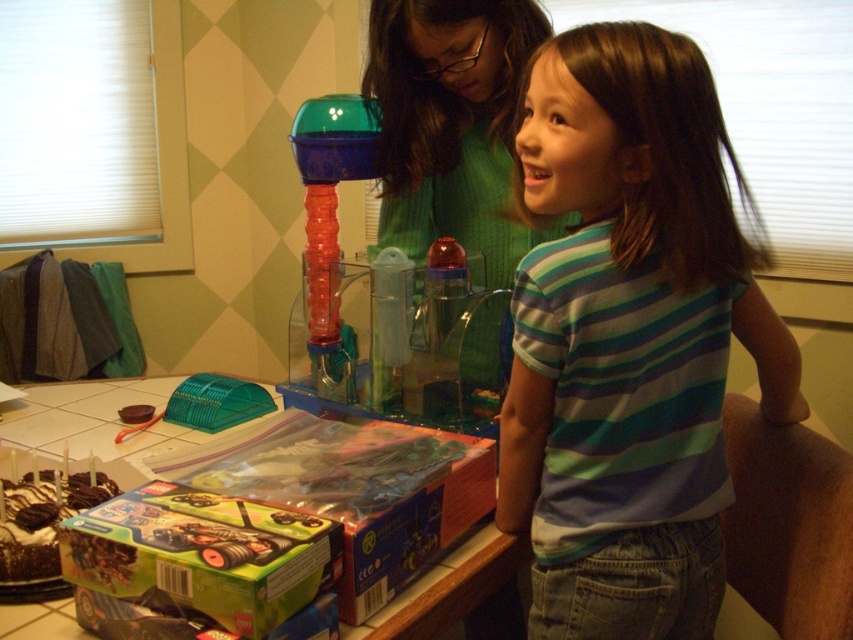
Question: Which point is closer to the camera taking this photo?

Choices:
 (A) (483, 310)
 (B) (637, 109)

Answer: (B)

Question: Does striped cotton shirt at center lie in front of green knitted sweater at upper center?

Choices:
 (A) no
 (B) yes

Answer: (B)

Question: Does striped cotton shirt at center appear on the right side of green knitted sweater at upper center?

Choices:
 (A) no
 (B) yes

Answer: (B)

Question: Can you confirm if striped cotton shirt at center is smaller than green knitted sweater at upper center?

Choices:
 (A) no
 (B) yes

Answer: (A)